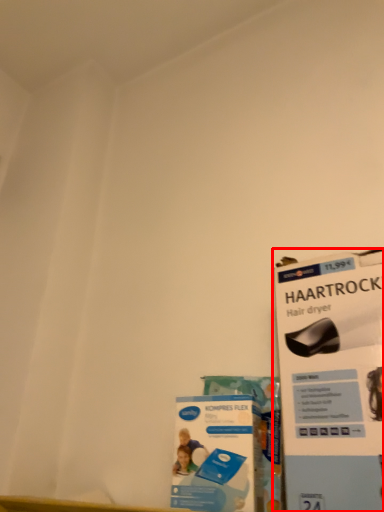
Question: From the image's perspective, what is the correct spatial relationship of magazine (annotated by the red box) in relation to flyer?

Choices:
 (A) below
 (B) above

Answer: (B)